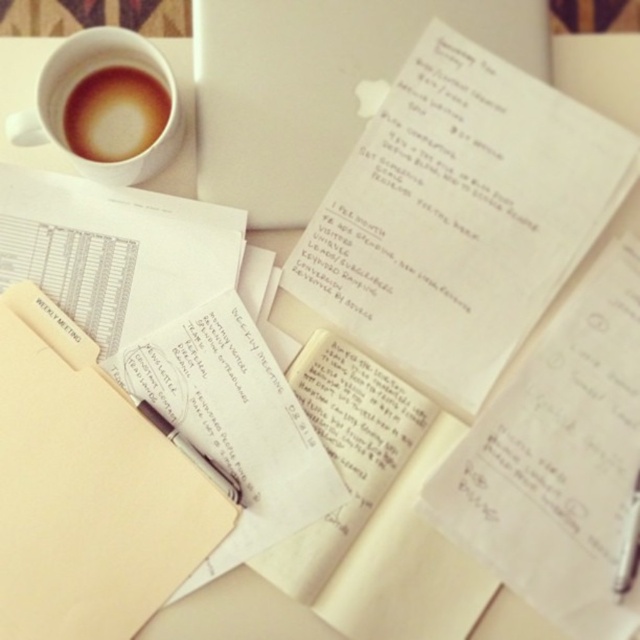
Question: Can you confirm if white paper at upper center is bigger than white matte cup at upper left?

Choices:
 (A) yes
 (B) no

Answer: (B)

Question: Is white paper at center further to the viewer compared to white matte cup at upper left?

Choices:
 (A) no
 (B) yes

Answer: (B)

Question: Which point is closer to the camera?

Choices:
 (A) white paper at center
 (B) white matte cup at upper left
 (C) black glossy pen at center

Answer: (B)

Question: Can you confirm if white matte cup at upper left is bigger than brown frothy coffee at upper left?

Choices:
 (A) no
 (B) yes

Answer: (B)

Question: Which point is closer to the camera?

Choices:
 (A) (180, 74)
 (B) (330, 92)
 (C) (147, 97)

Answer: (C)

Question: Which of the following is the farthest from the observer?

Choices:
 (A) (138, 100)
 (B) (321, 284)

Answer: (A)